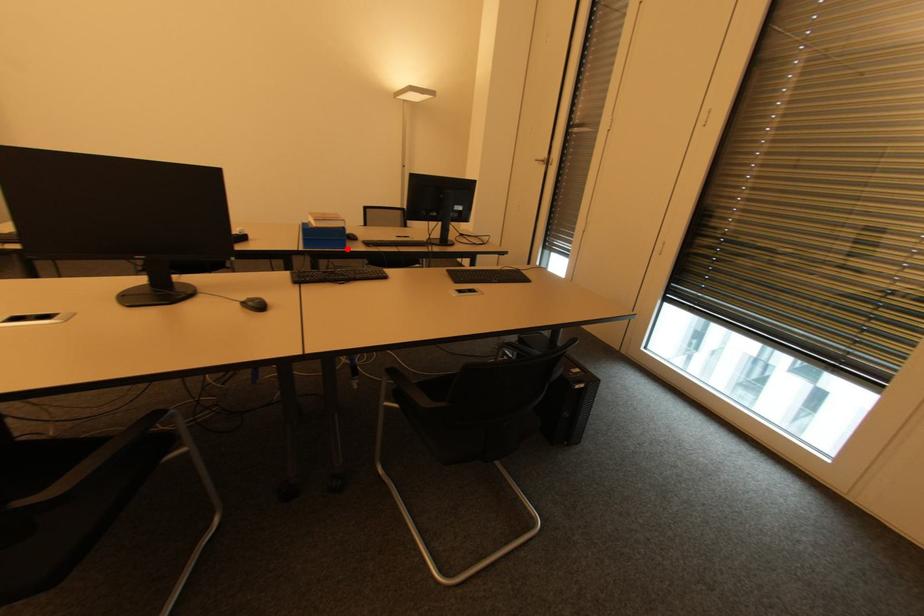
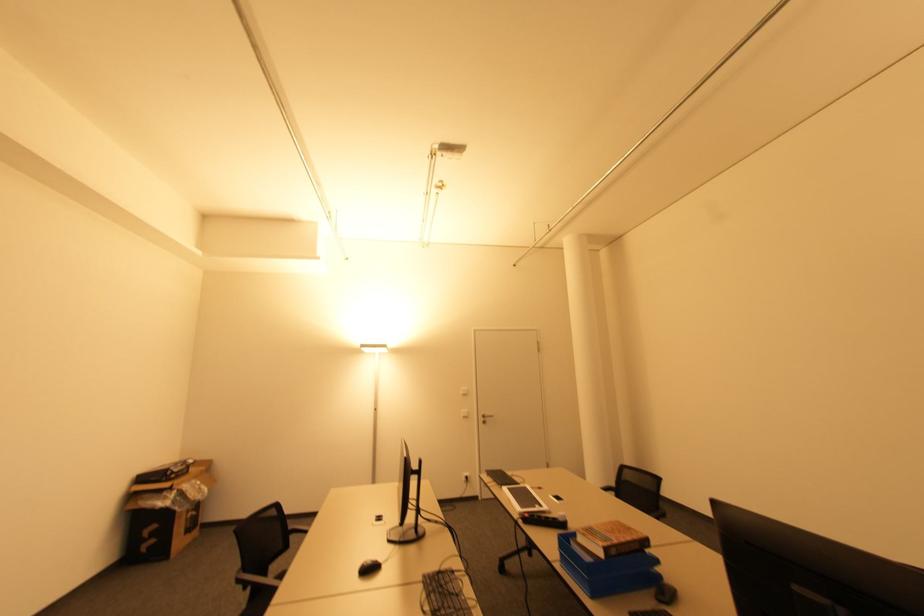
Question: I am providing you with two images of the same scene from different viewpoints. A red point is shown in image1. For the corresponding object point in image2, is it positioned nearer or farther from the camera?

Choices:
 (A) Nearer
 (B) Farther

Answer: (B)